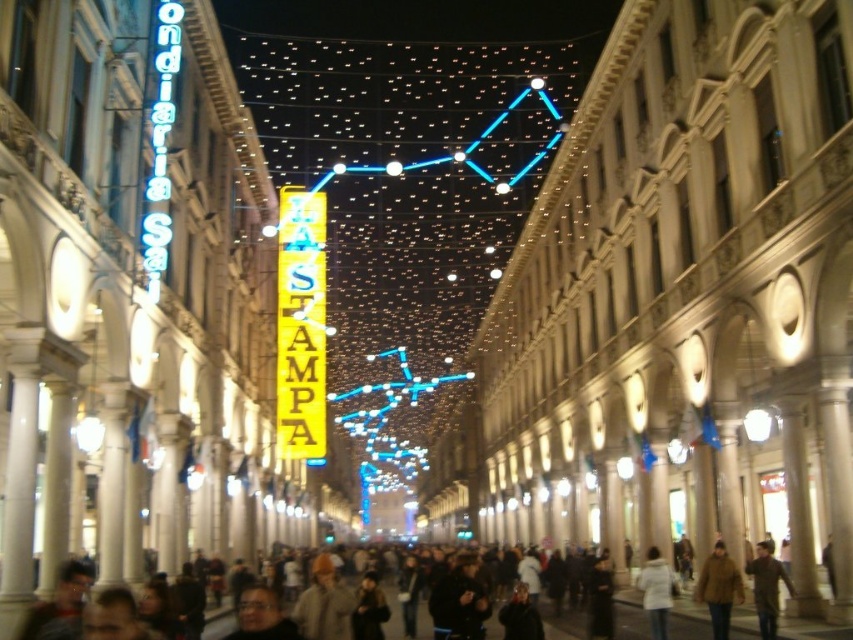
Consider the image. Does illuminated string lights at center come behind brown wool coat at center?

That is True.

Is point (517, 179) more distant than point (722, 556)?

Yes, point (517, 179) is behind point (722, 556).

Locate an element on the screen. illuminated string lights at center is located at coordinates (407, 205).

Is point (384, 243) in front of point (283, 253)?

No, (384, 243) is behind (283, 253).

This screenshot has width=853, height=640. Describe the element at coordinates (407, 205) in the screenshot. I see `illuminated string lights at center` at that location.

Which is behind, point (398, 202) or point (282, 243)?

The point (398, 202) is more distant.

I want to click on illuminated string lights at center, so tap(407, 205).

Does brown wool coat at center have a larger size compared to brown leather coat at center?

No, brown wool coat at center is not bigger than brown leather coat at center.

Does brown wool coat at center appear under brown leather coat at center?

Yes, brown wool coat at center is below brown leather coat at center.

Describe the element at coordinates (718, 588) in the screenshot. I see `brown wool coat at center` at that location.

Find the location of a particular element. brown wool coat at center is located at coordinates (718, 588).